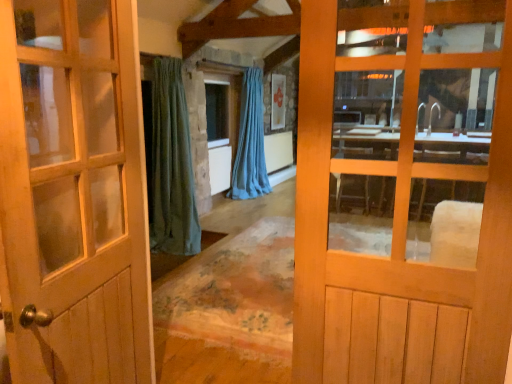
Question: Can you confirm if blue fabric curtain at center is taller than light brown wooden door at center, acting as the 1th door starting from the right?

Choices:
 (A) no
 (B) yes

Answer: (B)

Question: Is blue fabric curtain at center further to the viewer compared to light brown wooden door at center, which is counted as the 2th door, starting from the left?

Choices:
 (A) no
 (B) yes

Answer: (B)

Question: Can you confirm if blue fabric curtain at center is positioned to the left of light brown wooden door at center, which is counted as the 2th door, starting from the left?

Choices:
 (A) no
 (B) yes

Answer: (B)

Question: Is blue fabric curtain at center looking in the opposite direction of light brown wooden door at center, which is counted as the 2th door, starting from the left?

Choices:
 (A) no
 (B) yes

Answer: (A)

Question: Is light brown wooden door at center, which is counted as the 2th door, starting from the left, completely or partially inside blue fabric curtain at center?

Choices:
 (A) no
 (B) yes

Answer: (A)

Question: Considering the positions of light brown wooden door at center, acting as the 1th door starting from the right, and clear glass window at center in the image, is light brown wooden door at center, acting as the 1th door starting from the right, bigger or smaller than clear glass window at center?

Choices:
 (A) small
 (B) big

Answer: (B)

Question: Considering the positions of light brown wooden door at center, acting as the 1th door starting from the right, and clear glass window at center in the image, is light brown wooden door at center, acting as the 1th door starting from the right, taller or shorter than clear glass window at center?

Choices:
 (A) tall
 (B) short

Answer: (A)

Question: Considering the positions of point (359, 311) and point (239, 115), is point (359, 311) closer or farther from the camera than point (239, 115)?

Choices:
 (A) farther
 (B) closer

Answer: (B)

Question: In the image, is light brown wooden door at center, acting as the 1th door starting from the right, on the left side or the right side of clear glass window at center?

Choices:
 (A) right
 (B) left

Answer: (A)

Question: From a real-world perspective, is light brown wooden door at center, which is counted as the 2th door, starting from the left, above or below blue fabric curtain at center?

Choices:
 (A) below
 (B) above

Answer: (B)

Question: Would you say light brown wooden door at center, which is counted as the 2th door, starting from the left, is to the left or to the right of blue fabric curtain at center in the picture?

Choices:
 (A) right
 (B) left

Answer: (A)

Question: Does point (437, 342) appear closer or farther from the camera than point (246, 177)?

Choices:
 (A) farther
 (B) closer

Answer: (B)

Question: In terms of size, does light brown wooden door at center, acting as the 1th door starting from the right, appear bigger or smaller than blue fabric curtain at center?

Choices:
 (A) small
 (B) big

Answer: (A)

Question: Is point (33, 231) positioned closer to the camera than point (332, 296)?

Choices:
 (A) farther
 (B) closer

Answer: (B)

Question: Which is correct: matte wooden door at center, the first door in the left-to-right sequence, is inside light brown wooden door at center, which is counted as the 2th door, starting from the left, or outside of it?

Choices:
 (A) outside
 (B) inside

Answer: (A)